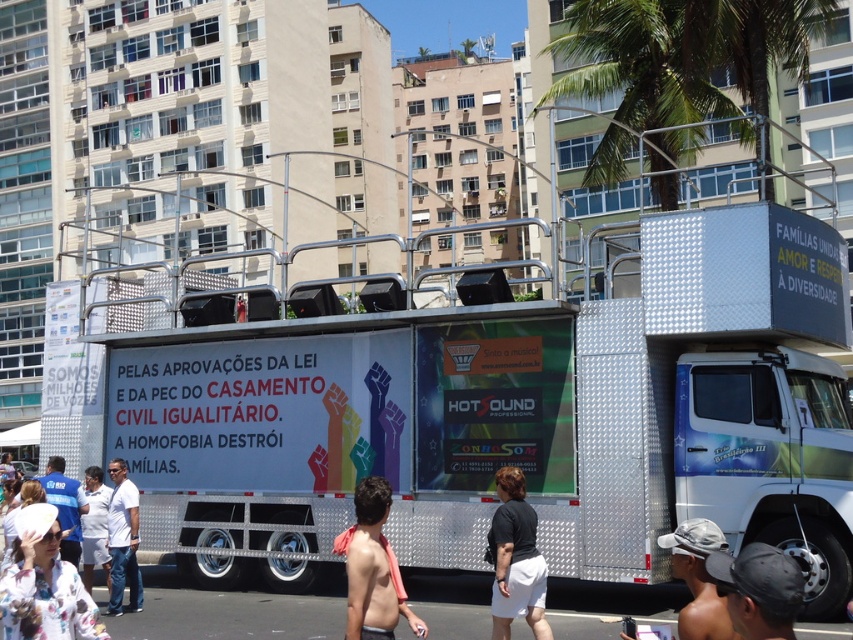
Is green leafy palm tree at upper center bigger than black fabric skirt at lower center?

Yes, green leafy palm tree at upper center is bigger than black fabric skirt at lower center.

Which is behind, point (691, 104) or point (505, 538)?

Point (691, 104)

What do you see at coordinates (639, 68) in the screenshot? I see `green leafy palm tree at upper center` at bounding box center [639, 68].

You are a GUI agent. You are given a task and a screenshot of the screen. Output one action in this format:
    pyautogui.click(x=<x>, y=<y>)
    Task: Click on the green leafy palm tree at upper center
    This screenshot has height=640, width=853.
    Given the screenshot: What is the action you would take?
    pyautogui.click(x=639, y=68)

Does white fabric shirt at lower left have a lesser width compared to blue shirt at lower left?

Indeed, white fabric shirt at lower left has a lesser width compared to blue shirt at lower left.

Who is positioned more to the left, white fabric shirt at lower left or blue shirt at lower left?

From the viewer's perspective, blue shirt at lower left appears more on the left side.

Which is behind, point (94, 492) or point (61, 552)?

The point (94, 492) is more distant.

I want to click on white fabric shirt at lower left, so click(96, 528).

Looking at this image, is black fabric skirt at lower center bigger than white fabric shirt at lower left?

Actually, black fabric skirt at lower center might be smaller than white fabric shirt at lower left.

Locate an element on the screen. Image resolution: width=853 pixels, height=640 pixels. black fabric skirt at lower center is located at coordinates (515, 560).

This screenshot has width=853, height=640. Identify the location of black fabric skirt at lower center. (515, 560).